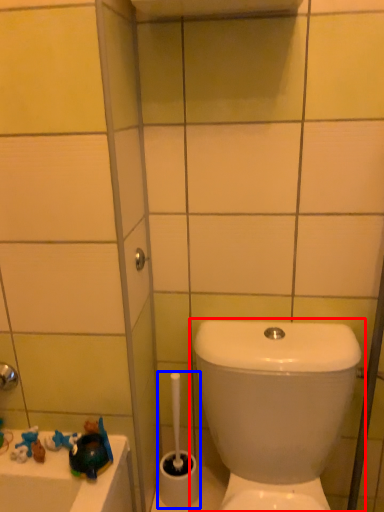
Question: Among these objects, which one is farthest to the camera, toilet (highlighted by a red box) or brush (highlighted by a blue box)?

Choices:
 (A) toilet
 (B) brush

Answer: (B)